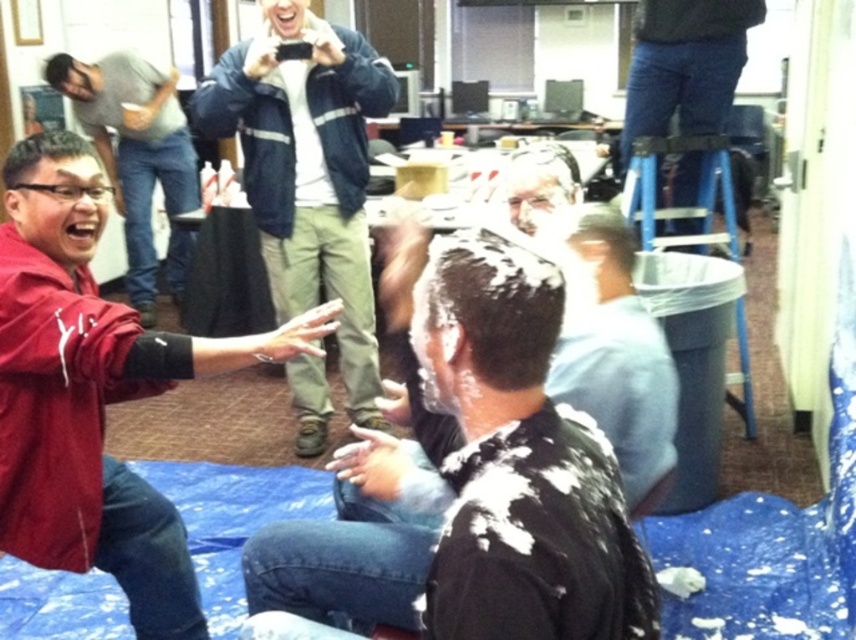
You are organizing a photoshoot in this office and need to place a large poster behind the shiny black shirt at center and the denim jacket at center. Which object should the poster be placed behind to ensure it doesn???t block either of them?

The poster should be placed behind the denim jacket at center because it occupies more space than the shiny black shirt at center, so placing it behind the larger object would avoid blocking both.

You are an observer standing at the entrance of the room. You see the denim jacket at center and the jeans at upper right. Which object is taller?

The denim jacket at center is taller than the jeans at upper right according to the description.

You are standing at the origin point in the room and want to move towards the point at coordinates point (281,224). Is there a clear path to reach it without passing through the other point at coordinates point (736,4)?

Yes, there is a clear path to reach point (281,224) without passing through point (736,4) because point (281,224) is behind point (736,4), meaning it is not blocking the direct route.